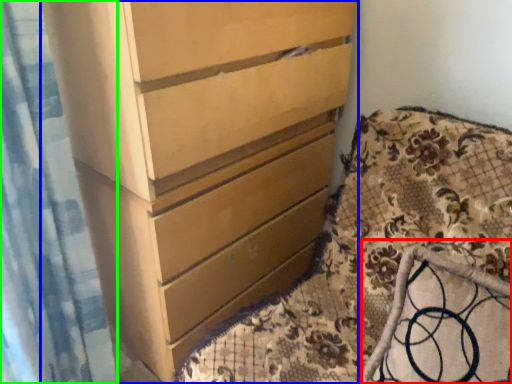
Question: Estimate the real-world distances between objects in this image. Which object is closer to rocking chair (highlighted by a red box), chest of drawers (highlighted by a blue box) or shower curtain (highlighted by a green box)?

Choices:
 (A) chest of drawers
 (B) shower curtain

Answer: (A)